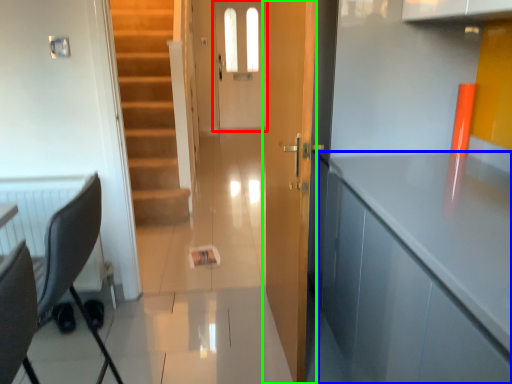
Question: Estimate the real-world distances between objects in this image. Which object is farther from screen door (highlighted by a red box), cabinetry (highlighted by a blue box) or door (highlighted by a green box)?

Choices:
 (A) cabinetry
 (B) door

Answer: (A)